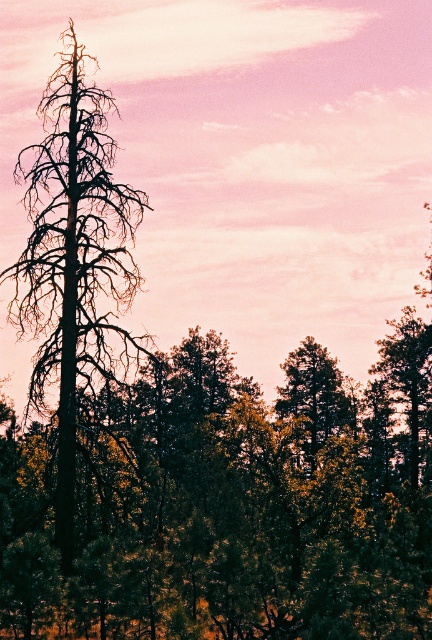
You are standing in the forest scene and want to determine which of the two points, point (44, 96) or point (279, 413), is closer to you. Based on the scene description, which point is nearer?

Point (44, 96) is closer to you than point (279, 413) because it is further to the viewer according to the description.

You are standing in the forest and want to locate the dark brown bark tree at left. According to the coordinates provided, where would you look relative to your position?

You should look to the left side since the dark brown bark tree at left is located at point (73, 257), which corresponds to the left area in the image.

You are a photographer standing at the camera position. You want to take a closeup shot of the dark brown bark tree at left. Is the tree within your camera range? The camera has a maximum zoom range of 50 meters.

The dark brown bark tree at left is 40.32 meters away from camera, which is within the camera range of 50 meters. Therefore, you can take a closeup shot of the dark brown bark tree at left using the camera.